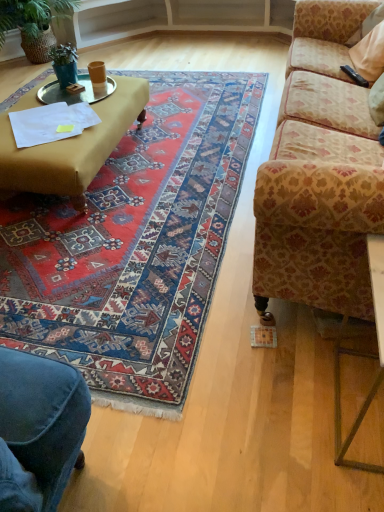
At what (x,y) coordinates should I click in order to perform the action: click on vacant space underneath metallic gold table at lower right (from a real-world perspective). Please return your answer as a coordinate pair (x, y). This screenshot has height=512, width=384. Looking at the image, I should click on 354,403.